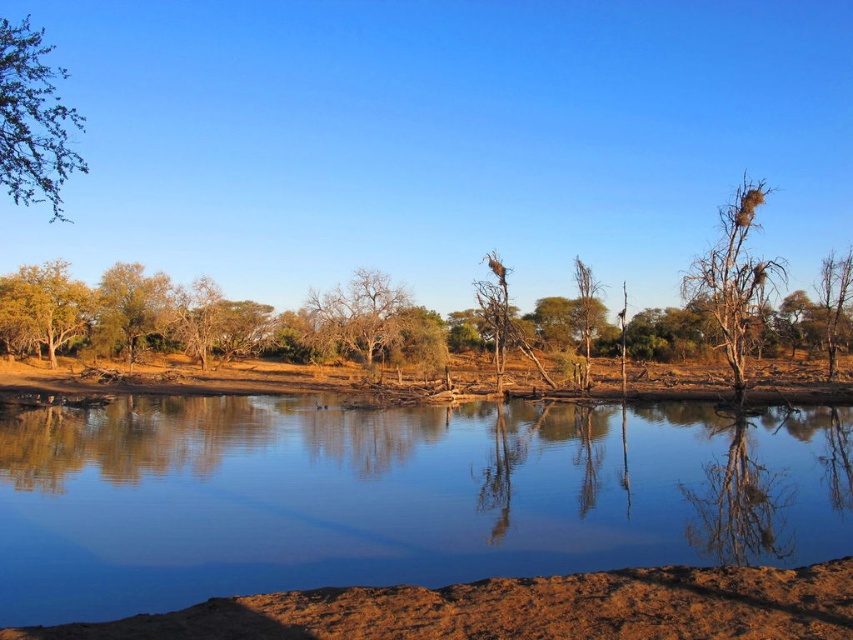
You are standing at the center of the image. Which direction should you look to see the green leafy tree at upper left?

The green leafy tree at upper left is located at point (33, 120), which is in the upper left direction from the center of the image.

You are standing at point A at point(x=703, y=259). You want to walk to point B, which is 64.96 meters away. Is there any obstacle between you and point B?

There are no obstacles between point A at point(x=703, y=259) and point B, which is 64.96 meters away, as the scene describes a serene natural landscape with a calm body of water and scattered trees, but no mention of any barriers or obstructions in the direct path.

You are standing at the edge of the water and see the green leafy tree at upper left and the green leafy tree at left. Which tree is closer to your left side?

The green leafy tree at upper left is positioned on the left side of green leafy tree at left, so it is closer to your left side.